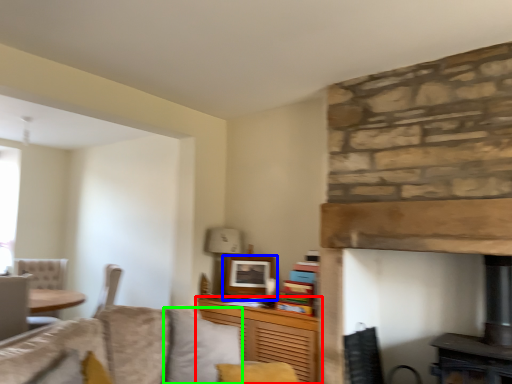
Question: Which is nearer to the cabinetry (highlighted by a red box)? picture frame (highlighted by a blue box) or pillow (highlighted by a green box).

Choices:
 (A) picture frame
 (B) pillow

Answer: (A)